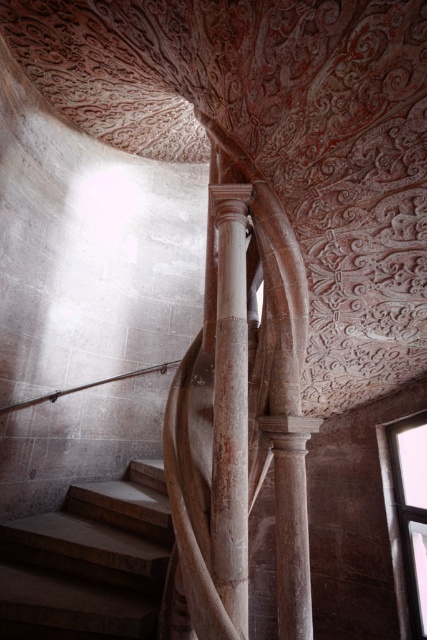
You are an architect inspecting the spiral staircase. You need to determine which structure is shorter between the smooth stone stairs at center and the smooth stone column at center. Which one is shorter?

The smooth stone stairs at center is shorter than the smooth stone column at center.

You are an architect inspecting the spiral staircase in the image. You need to determine if the satin silver railing at upper center is tall enough to meet safety standards. Given that the minimum required height for railings is 1 meter, and the smooth stone stairs at center are 1.2 meters tall, can the railing provide adequate safety?

The smooth stone stairs at center are 1.2 meters tall and have a greater height compared to the satin silver railing at upper center. Since the railing is shorter than the stairs, it may not meet the 1 meter safety requirement. Therefore, the satin silver railing at upper center might not provide adequate safety.

You are standing at the entrance of the historic building and want to reach the second floor. The smooth stone stairs at center are your only path. Can you confirm their location relative to the entrance?

The smooth stone stairs at center are located at point (90, 561), which means they are positioned to your right and slightly ahead from the entrance.